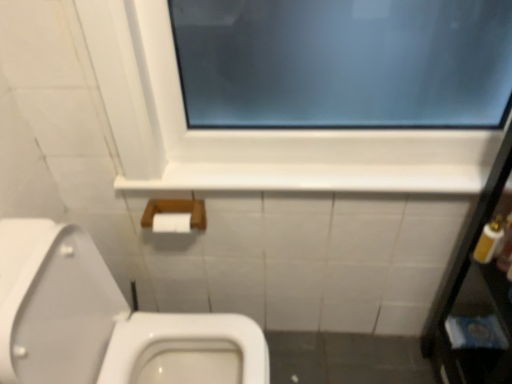
Locate an element on the screen. The image size is (512, 384). empty space that is ontop of white glossy ledge at upper center (from a real-world perspective) is located at coordinates (359, 166).